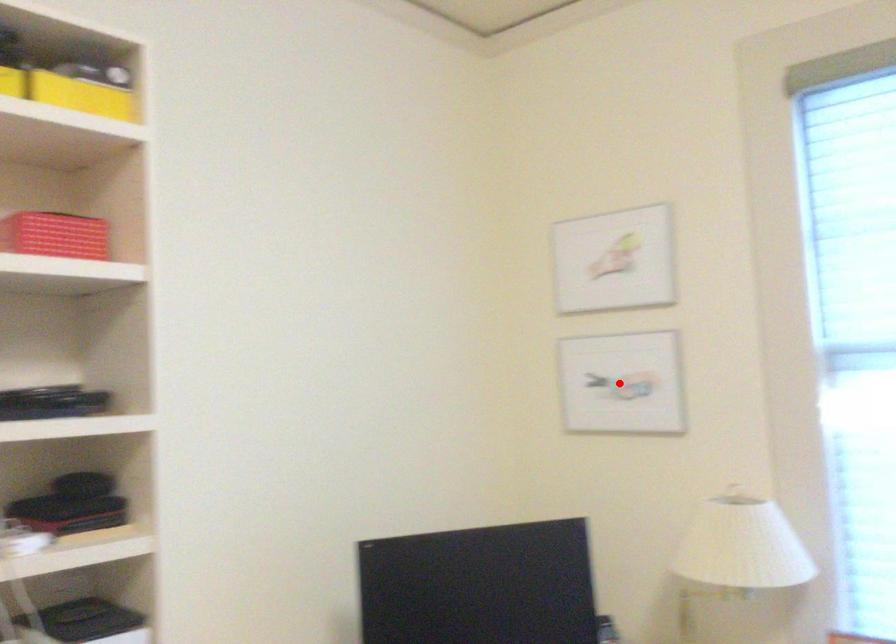
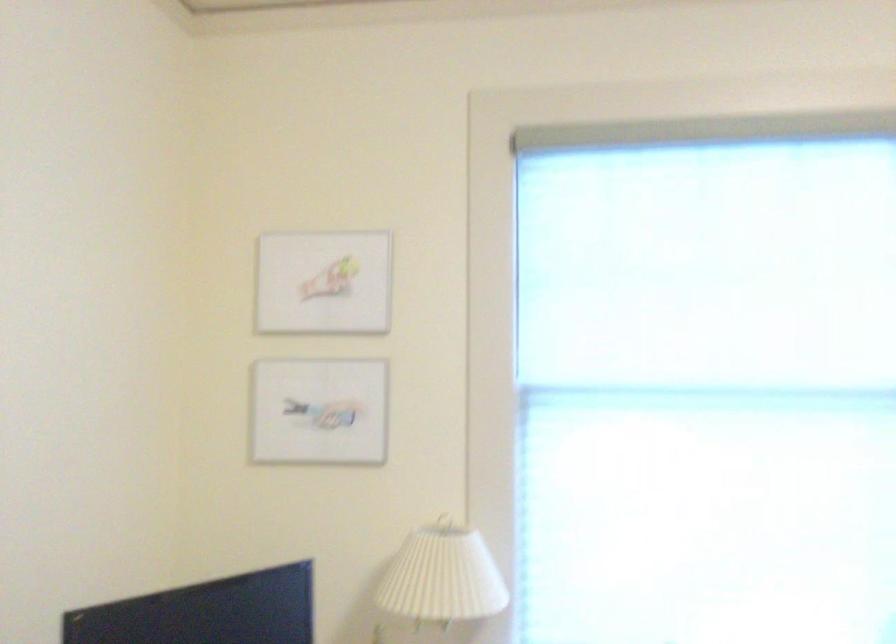
The point at the highlighted location is marked in the first image. Where is the corresponding point in the second image?

(319, 412)